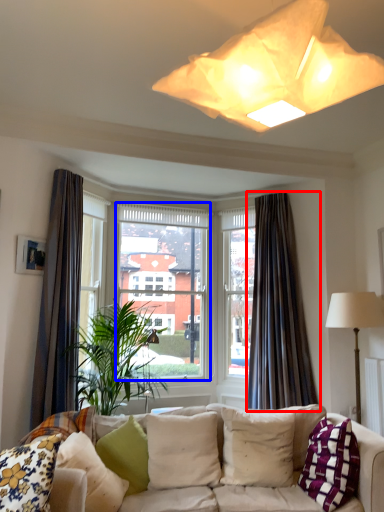
Question: Which object appears farthest to the camera in this image, curtain (highlighted by a red box) or window screen (highlighted by a blue box)?

Choices:
 (A) curtain
 (B) window screen

Answer: (B)